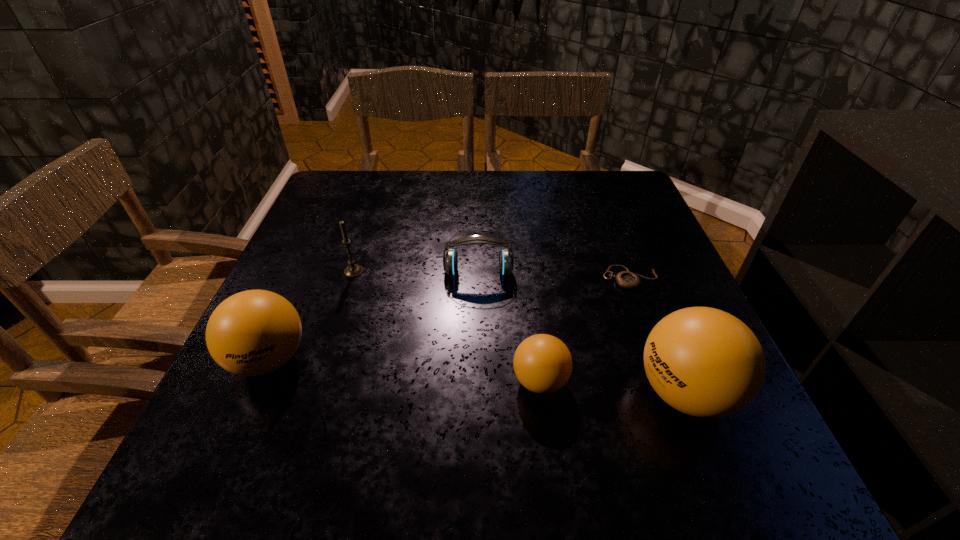
The width and height of the screenshot is (960, 540). Identify the location of blank area located 0.130m on the side with brand of the rightmost ping-pong ball. (560, 393).

The height and width of the screenshot is (540, 960). Find the location of `free space located on the right of the candle`. free space located on the right of the candle is located at coordinates (526, 272).

Locate an element on the screen. The width and height of the screenshot is (960, 540). vacant area situated on the ear cups of the headset is located at coordinates (478, 356).

Where is `vacant point located on the back of the shortest object`? The height and width of the screenshot is (540, 960). vacant point located on the back of the shortest object is located at coordinates (598, 191).

This screenshot has height=540, width=960. I want to click on ping-pong ball present at the left edge, so click(x=252, y=333).

Where is `candle located in the left edge section of the desktop`? candle located in the left edge section of the desktop is located at coordinates (353, 270).

Identify the location of ping-pong ball at the right edge. (704, 362).

Find the location of `pocket watch at the right edge`. pocket watch at the right edge is located at coordinates click(x=628, y=280).

The image size is (960, 540). What are the coordinates of `object that is positioned at the near left corner` in the screenshot? It's located at (252, 333).

Where is `object at the near right corner`? Image resolution: width=960 pixels, height=540 pixels. object at the near right corner is located at coordinates (704, 362).